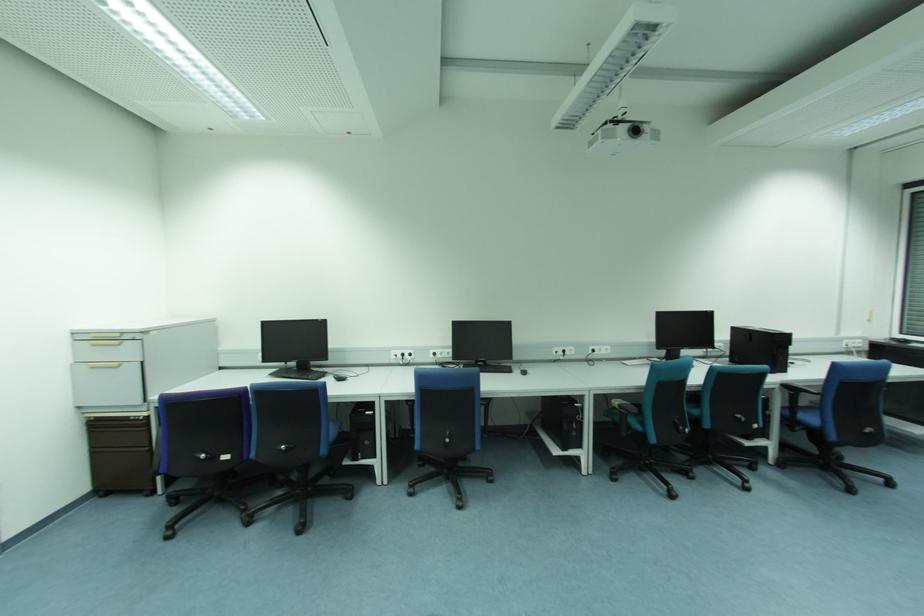
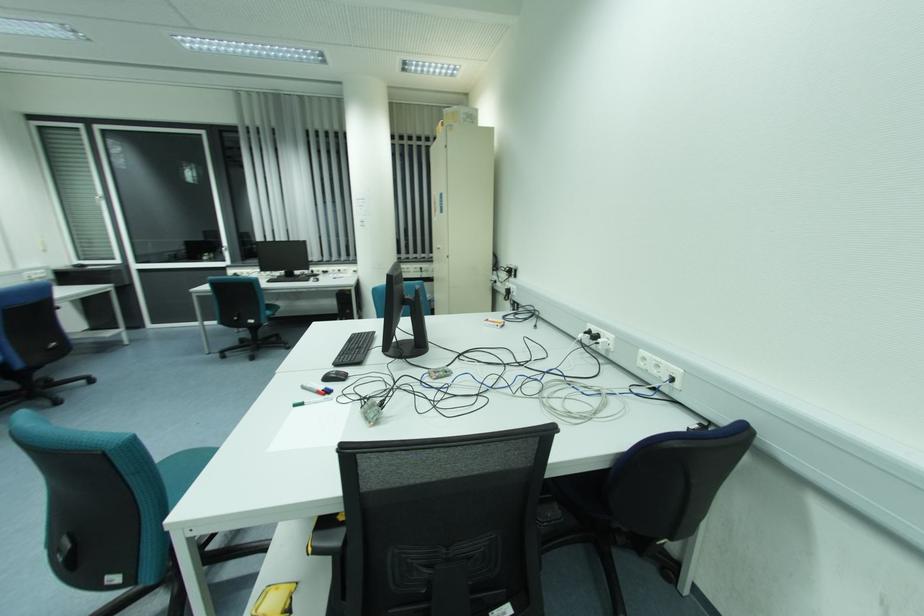
Question: How did the camera likely rotate?

Choices:
 (A) Left
 (B) Right
 (C) Up
 (D) Down

Answer: (B)